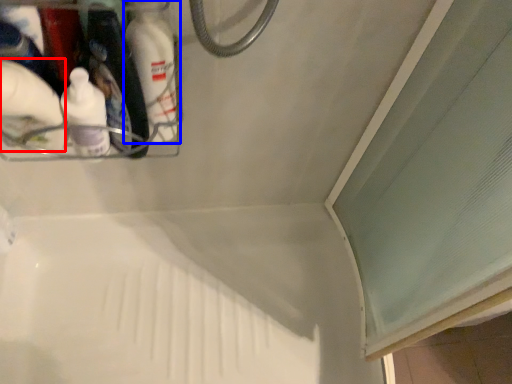
Question: Which object is closer to the camera taking this photo, cleaning product (highlighted by a red box) or bottle (highlighted by a blue box)?

Choices:
 (A) cleaning product
 (B) bottle

Answer: (A)